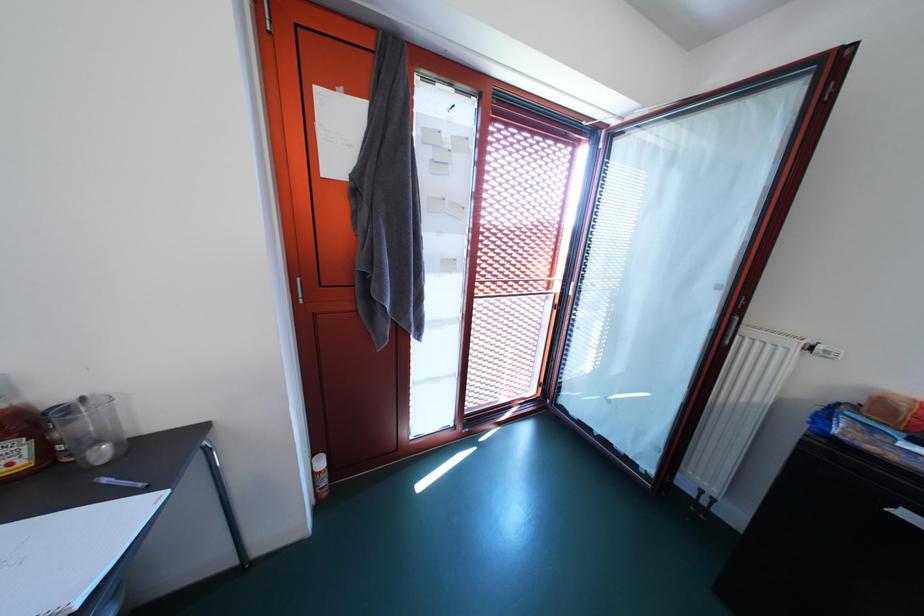
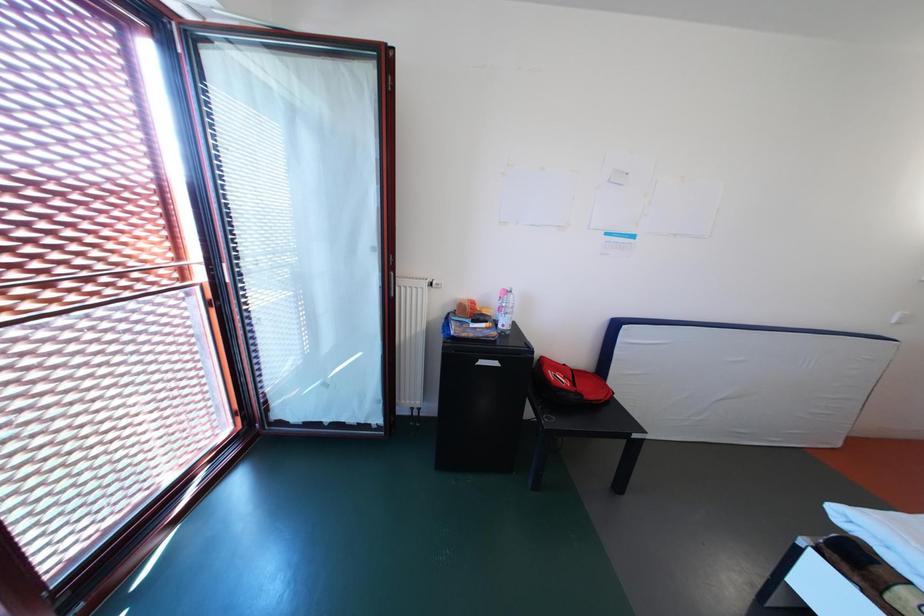
Question: The first image is from the beginning of the video and the second image is from the end. How did the camera likely rotate when shooting the video?

Choices:
 (A) Left
 (B) Right
 (C) Up
 (D) Down

Answer: (B)